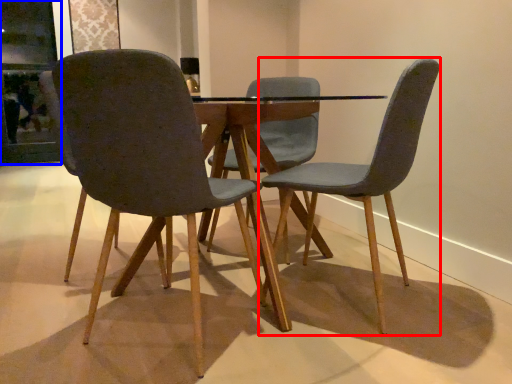
Question: Among these objects, which one is nearest to the camera, chair (highlighted by a red box) or glass door (highlighted by a blue box)?

Choices:
 (A) chair
 (B) glass door

Answer: (A)